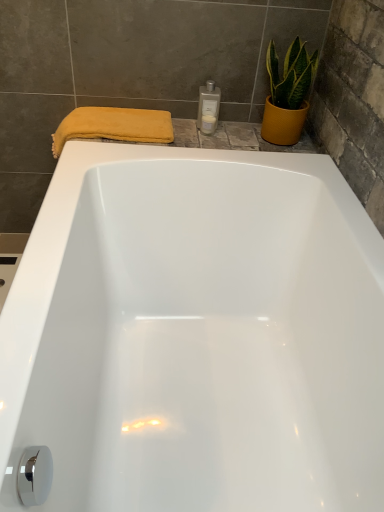
The image size is (384, 512). Identify the location of vacant space in between yellow textured pot at upper right and white glossy bottle at upper right, which ranks as the 1th toiletry in top-to-bottom order. (236, 134).